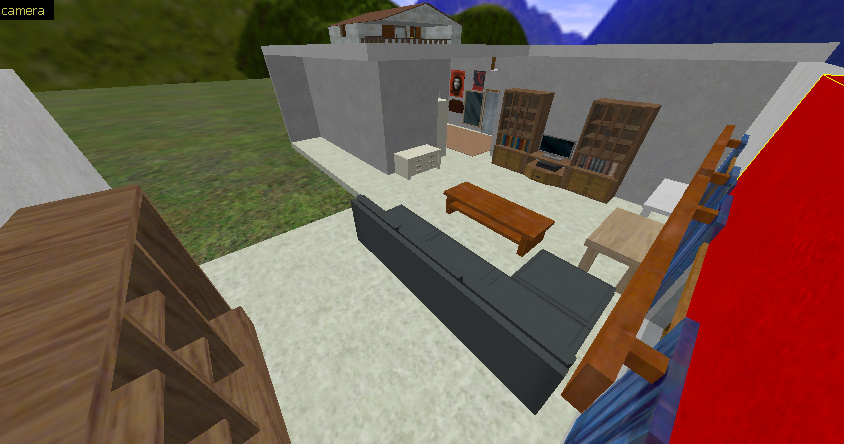
You are a GUI agent. You are given a task and a screenshot of the screen. Output one action in this format:
    pyautogui.click(x=<x>, y=<y>)
    Task: Click on the shelf
    
    Given the screenshot: What is the action you would take?
    pyautogui.click(x=527, y=117)